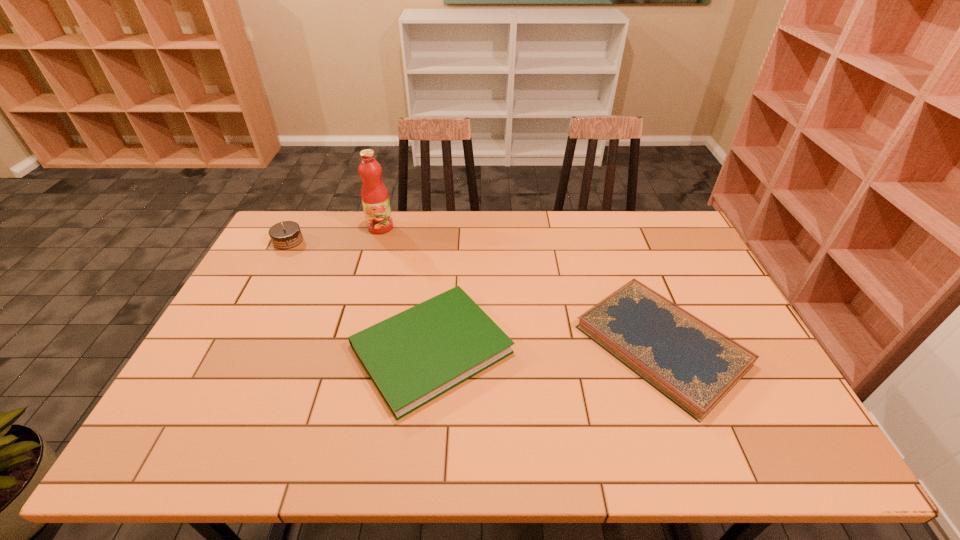
Identify which object is the third nearest to the left paperback book. Please provide its 2D coordinates. Your answer should be formatted as a tuple, i.e. [(x, y)], where the tuple contains the x and y coordinates of a point satisfying the conditions above.

[(285, 235)]

Where is `free space that satisfies the following two spatial constraints: 1. on the front label of the fruit juice; 2. on the right side of the rightmost object`? free space that satisfies the following two spatial constraints: 1. on the front label of the fruit juice; 2. on the right side of the rightmost object is located at coordinates (347, 346).

Where is `blank area in the image that satisfies the following two spatial constraints: 1. on the front side of the second tallest object; 2. on the right side of the left paperback book`? This screenshot has width=960, height=540. blank area in the image that satisfies the following two spatial constraints: 1. on the front side of the second tallest object; 2. on the right side of the left paperback book is located at coordinates pyautogui.click(x=230, y=349).

You are a GUI agent. You are given a task and a screenshot of the screen. Output one action in this format:
    pyautogui.click(x=<x>, y=<y>)
    Task: Click on the vacant space that satisfies the following two spatial constraints: 1. on the front label of the left paperback book; 2. on the right side of the fruit juice
    The image size is (960, 540).
    Given the screenshot: What is the action you would take?
    pyautogui.click(x=346, y=349)

Where is `blank space that satisfies the following two spatial constraints: 1. on the front label of the rightmost object; 2. on the right side of the tallest object`? This screenshot has height=540, width=960. blank space that satisfies the following two spatial constraints: 1. on the front label of the rightmost object; 2. on the right side of the tallest object is located at coordinates (347, 346).

Locate an element on the screen. vacant space that satisfies the following two spatial constraints: 1. on the back side of the left paperback book; 2. on the left side of the rightmost object is located at coordinates (432, 346).